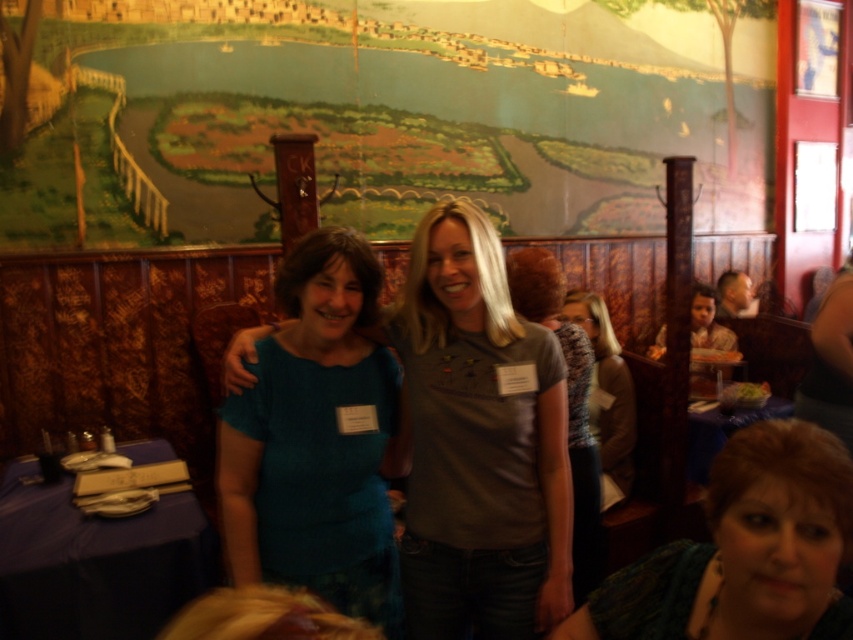
You are a photographer setting up for a group photo in the restaurant. You need to ensure that the teal knit sweater at center is visible above the green painted wall at upper center. Based on their heights, is this possible?

The green painted wall at upper center is taller than the teal knit sweater at center, so the sweater cannot be seen above the wall unless the photographer adjusts the angle or position.

You are taking a photo of the two people in the scene. Which clothing item, the matte gray shirt at center or the gray textured sweater at center, is located to the left when viewed from the front?

The matte gray shirt at center is positioned on the left side of the gray textured sweater at center, so it is located to the left when viewed from the front.